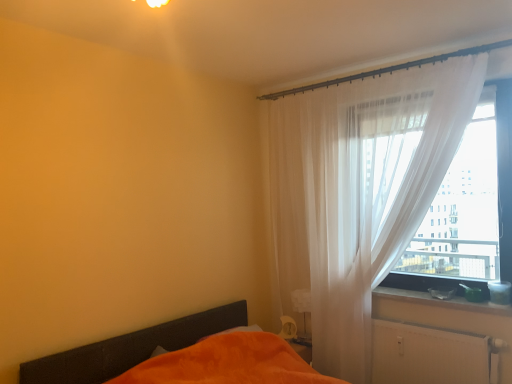
Find the location of a particular element. blank space above matte plastic container at right (from a real-world perspective) is located at coordinates (439, 294).